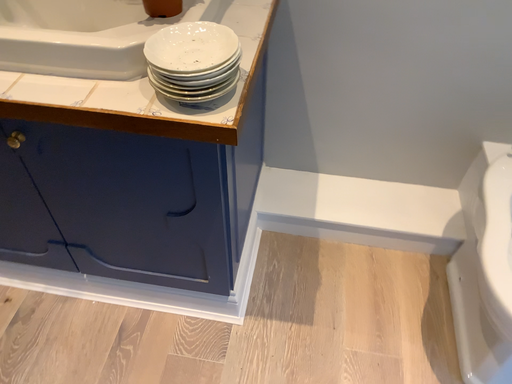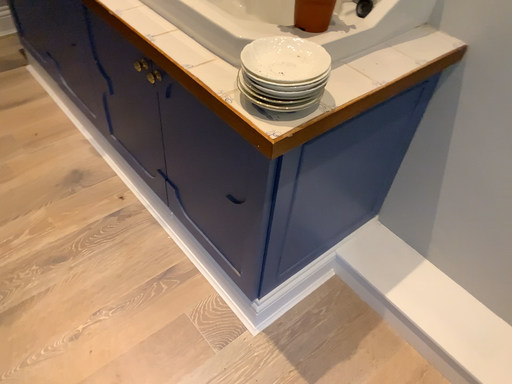
Question: Which way did the camera rotate in the video?

Choices:
 (A) rotated right
 (B) rotated left

Answer: (B)